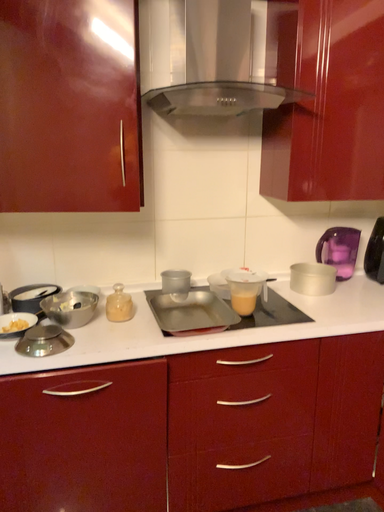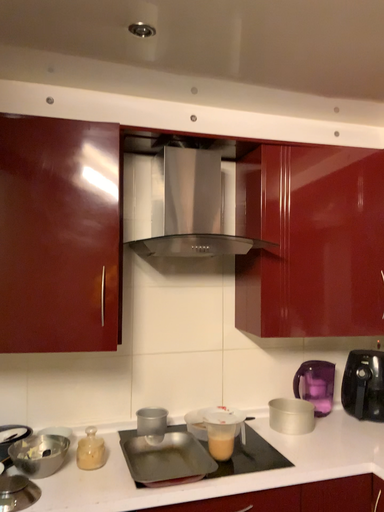
Question: How did the camera likely rotate when shooting the video?

Choices:
 (A) rotated downward
 (B) rotated upward

Answer: (B)